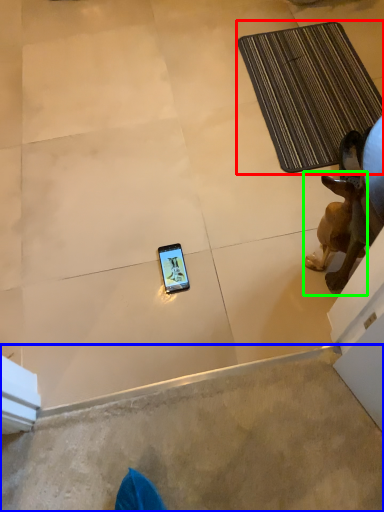
Question: Which is nearer to the bath mat (highlighted by a red box)? concrete (highlighted by a blue box) or dog (highlighted by a green box).

Choices:
 (A) concrete
 (B) dog

Answer: (B)